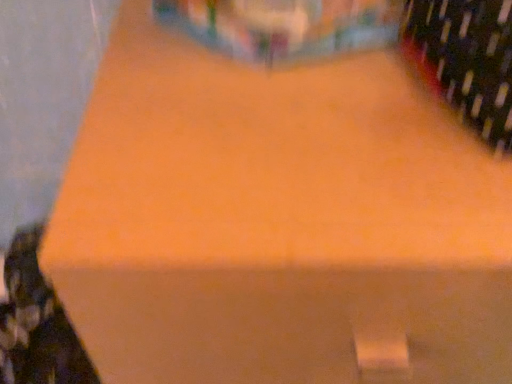
Question: From a real-world perspective, is matte black wine bottle at lower left, acting as the 2th wine bottle starting from the right, above or below dark green glass wine bottle at upper right, which appears as the second wine bottle when viewed from the left?

Choices:
 (A) below
 (B) above

Answer: (A)

Question: Considering the positions of point (31, 233) and point (490, 84), is point (31, 233) closer or farther from the camera than point (490, 84)?

Choices:
 (A) farther
 (B) closer

Answer: (A)

Question: From the image's perspective, is matte black wine bottle at lower left, the first wine bottle positioned from the bottom, located above or below dark green glass wine bottle at upper right, the 2th wine bottle ordered from the bottom?

Choices:
 (A) below
 (B) above

Answer: (A)

Question: Is dark green glass wine bottle at upper right, acting as the first wine bottle starting from the right, taller or shorter than matte black wine bottle at lower left, acting as the 2th wine bottle starting from the right?

Choices:
 (A) short
 (B) tall

Answer: (A)

Question: From a real-world perspective, is dark green glass wine bottle at upper right, the 2th wine bottle ordered from the bottom, positioned above or below matte black wine bottle at lower left, which is counted as the 1th wine bottle, starting from the back?

Choices:
 (A) above
 (B) below

Answer: (A)

Question: Considering the positions of point (496, 117) and point (36, 241), is point (496, 117) closer or farther from the camera than point (36, 241)?

Choices:
 (A) closer
 (B) farther

Answer: (A)

Question: From the image's perspective, is dark green glass wine bottle at upper right, placed as the first wine bottle when sorted from front to back, above or below matte black wine bottle at lower left, the first wine bottle positioned from the bottom?

Choices:
 (A) below
 (B) above

Answer: (B)